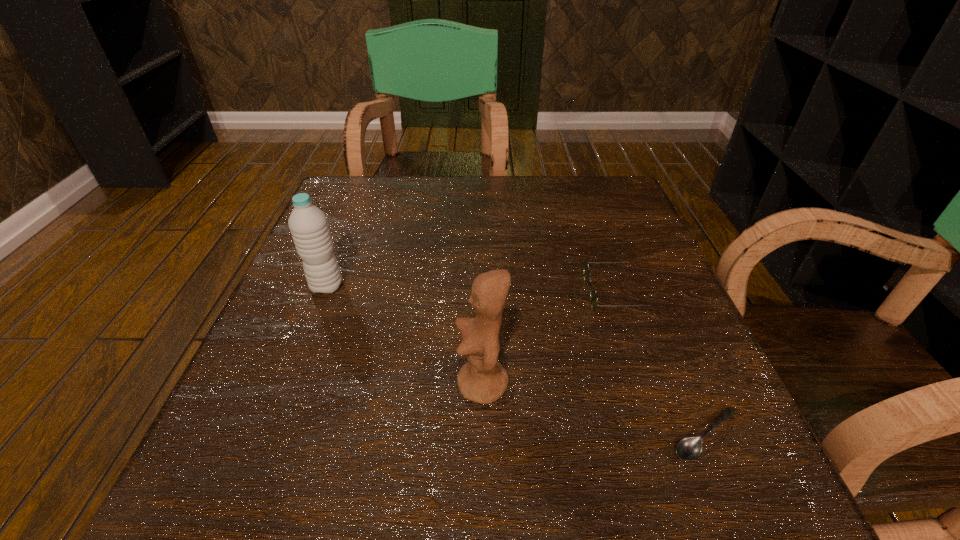
Where is `free spot that satisfies the following two spatial constraints: 1. on the front-facing side of the shortest object; 2. on the right side of the second object from left to right`? free spot that satisfies the following two spatial constraints: 1. on the front-facing side of the shortest object; 2. on the right side of the second object from left to right is located at coordinates (483, 435).

Locate an element on the screen. Image resolution: width=960 pixels, height=540 pixels. vacant space that satisfies the following two spatial constraints: 1. on the front-facing side of the second shortest object; 2. on the left side of the soupspoon is located at coordinates (668, 435).